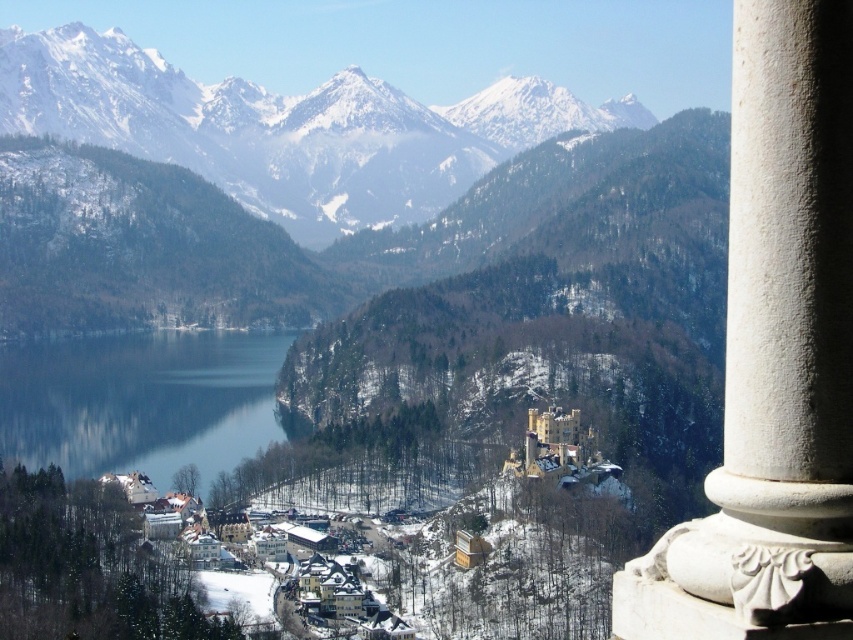
You are a drone operator tasked with capturing aerial footage of the mountain landscape. Your drone has a maximum flight range of 250 meters. If you are currently positioned at the white stone column at right, can you safely fly your drone to the blue glass water at center without exceeding its range?

The white stone column at right and blue glass water at center are 247.89 meters apart from each other. Since the drone has a maximum flight range of 250 meters, it can safely reach the blue glass water at center without exceeding its limit.

You are standing at the edge of a mountain overlook and want to take a photo of the white stone column at right. If your camera has a focal length of 50mm and you are 107.10 feet away from the column, what is the approximate angle of view needed to capture the entire column in the frame?

The white stone column at right is 107.10 feet away from the viewer. Using the formula for angle of view calculation, the required angle would depend on the camera sensor size and the column height. However, without specific dimensions, it is difficult to provide an exact angle. A 50mm lens on a full frame camera typically has an angle of view around 46 degrees, which might suffice depending on the column size.

You are a photographer planning to capture the reflection of the snowy granite mountains at upper left in the blue glass water at center. Based on their positions, do you think the reflection will be visible in the water?

The snowy granite mountains at upper left is positioned on the right side of blue glass water at center, so the reflection of the snowy granite mountains at upper left would appear on the right side of the blue glass water at center. Since reflections are mirrored, the reflection should be visible in the water if the angle and lighting conditions allow.